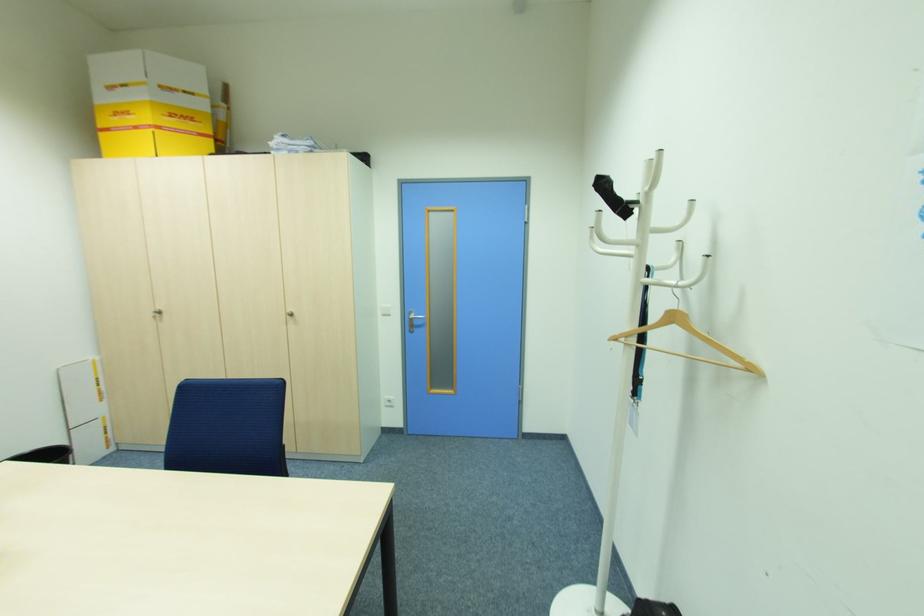
Find where to hang the white coat rack hook. Please return your answer as a coordinate pair (x, y).

(691, 229)